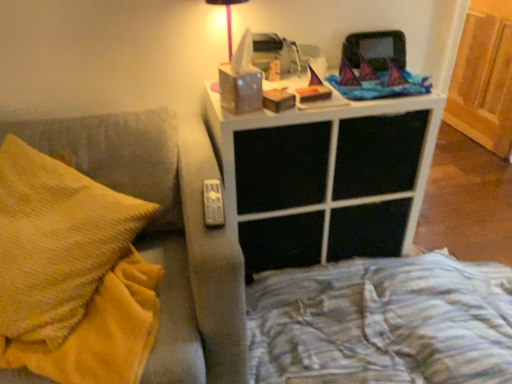
Question: Is point [229, 56] closer or farther from the camera than point [257, 201]?

Choices:
 (A) closer
 (B) farther

Answer: (A)

Question: Relative to white matte nightstand at upper center, is matte white tissue box at upper center in front or behind?

Choices:
 (A) front
 (B) behind

Answer: (B)

Question: Which is nearer to the yellow fleece blanket at left?

Choices:
 (A) wooden bed frame at lower right
 (B) white matte nightstand at upper center
 (C) matte white tissue box at upper center
 (D) suede-like gray couch armrest at left

Answer: (D)

Question: Estimate the real-world distances between objects in this image. Which object is closer to the wooden bed frame at lower right?

Choices:
 (A) yellow fleece blanket at left
 (B) matte white tissue box at upper center
 (C) suede-like gray couch armrest at left
 (D) white matte nightstand at upper center

Answer: (D)